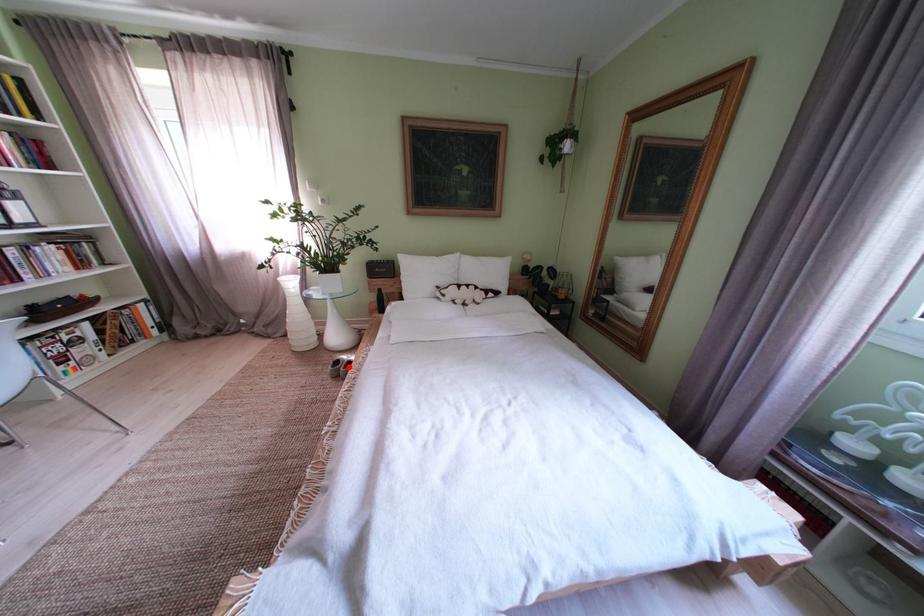
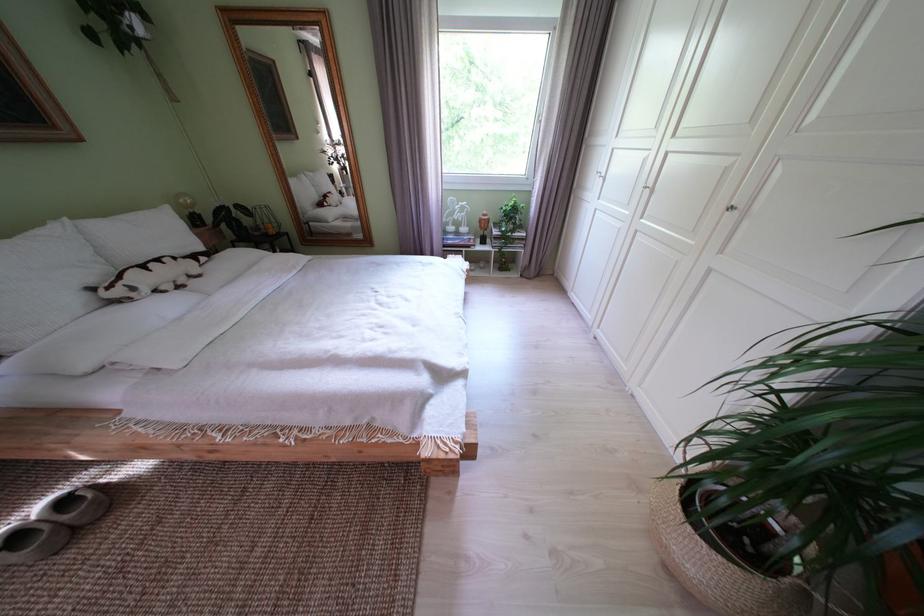
Find the pixel in the second image that matches the highlighted location in the first image.

(28, 543)